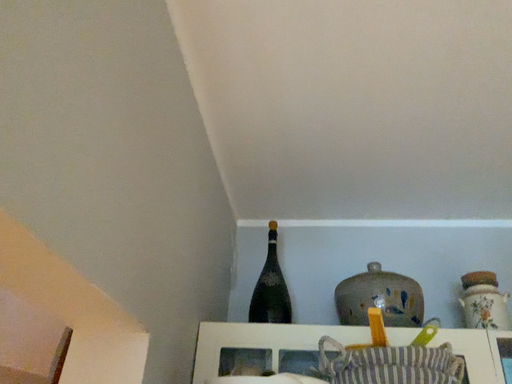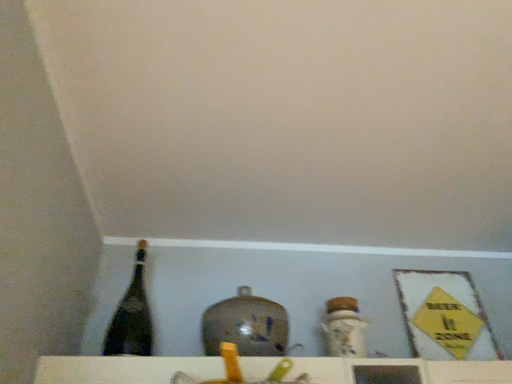
Question: Which way did the camera rotate in the video?

Choices:
 (A) rotated right
 (B) rotated left

Answer: (A)